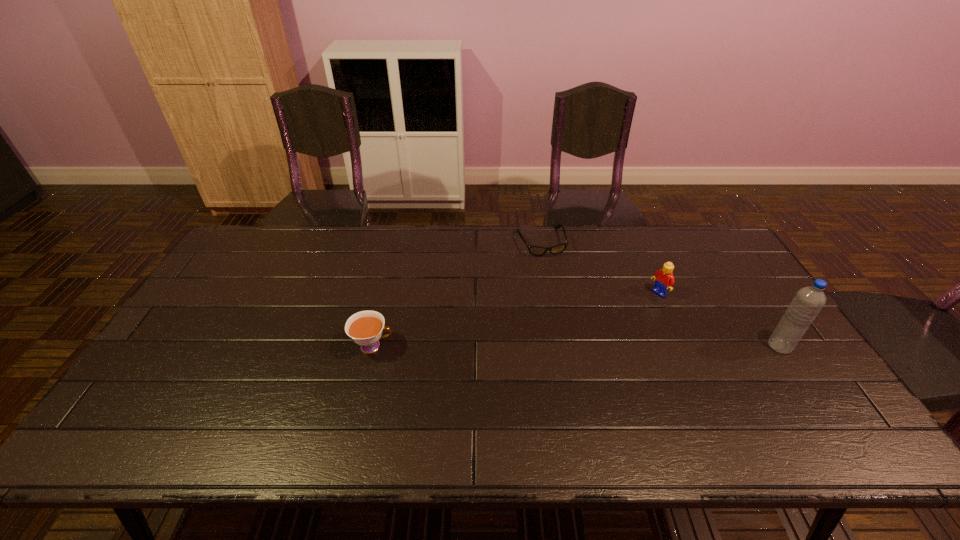
What are the coordinates of `vacant area situated 0.220m on the front-facing side of the second tallest object` in the screenshot? It's located at (604, 329).

Where is `vacant position located 0.140m on the front-facing side of the second tallest object`? The width and height of the screenshot is (960, 540). vacant position located 0.140m on the front-facing side of the second tallest object is located at coordinates (623, 317).

You are a GUI agent. You are given a task and a screenshot of the screen. Output one action in this format:
    pyautogui.click(x=<x>, y=<y>)
    Task: Click on the free space located 0.240m on the front-facing side of the second tallest object
    The height and width of the screenshot is (540, 960).
    Given the screenshot: What is the action you would take?
    pyautogui.click(x=599, y=332)

What are the coordinates of `vacant region located on the front-facing side of the second object from left to right` in the screenshot? It's located at (575, 336).

You are a GUI agent. You are given a task and a screenshot of the screen. Output one action in this format:
    pyautogui.click(x=<x>, y=<y>)
    Task: Click on the vacant space situated 0.310m on the front-facing side of the second object from left to right
    The image size is (960, 540).
    Given the screenshot: What is the action you would take?
    pyautogui.click(x=571, y=325)

Locate an element on the screen. The width and height of the screenshot is (960, 540). vacant region located on the front-facing side of the second object from left to right is located at coordinates (553, 275).

Where is `object that is at the far edge`? The width and height of the screenshot is (960, 540). object that is at the far edge is located at coordinates (557, 249).

This screenshot has width=960, height=540. Identify the location of object that is at the right edge. point(805,306).

In the image, there is a desktop. Identify the location of vacant space at the far edge. The height and width of the screenshot is (540, 960). (464, 237).

Locate an element on the screen. vacant space at the near edge of the desktop is located at coordinates (313, 398).